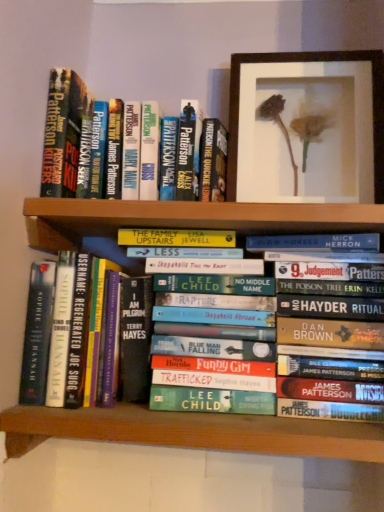
Find the location of `free space above green matte bookshelf at lower center (from a real-world perspective)`. free space above green matte bookshelf at lower center (from a real-world perspective) is located at coordinates (231, 406).